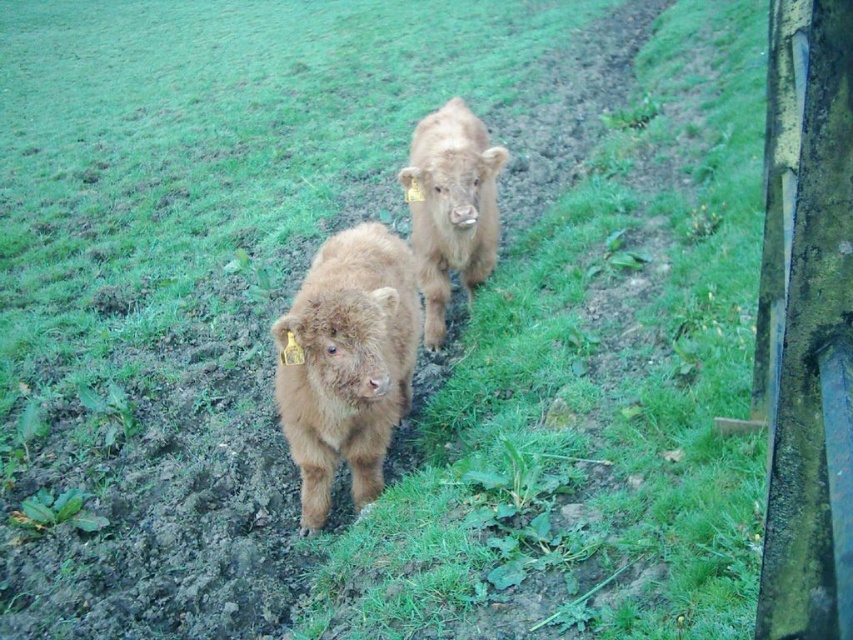
You are a farmer checking on your calves. You notice two calves at the center of the image. Which calf is closer to you, the fuzzy brown calf at center or the brown furry calf at center?

The fuzzy brown calf at center is closer to you since it is in front of the brown furry calf at center.

You are a farmer checking the herd. You notice two calves at center. Which calf is closer to the ground, the fuzzy brown calf at center or the brown furry calf at center?

The fuzzy brown calf at center is closer to the ground because it is below the brown furry calf at center.